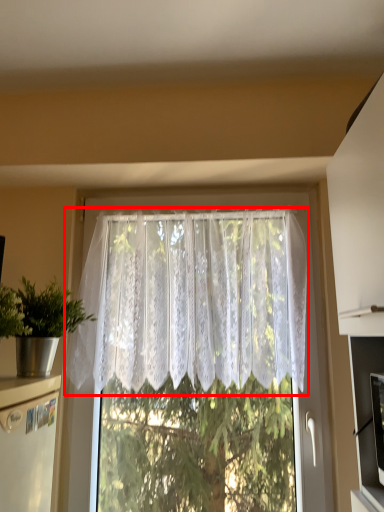
Question: From the image's perspective, considering the relative positions of curtain (annotated by the red box) and houseplant in the image provided, where is curtain (annotated by the red box) located with respect to the staircase?

Choices:
 (A) above
 (B) below

Answer: (A)